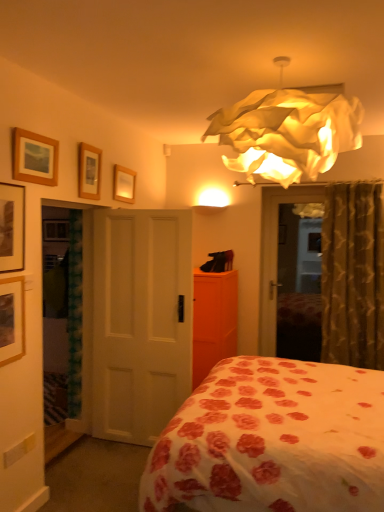
Image resolution: width=384 pixels, height=512 pixels. Describe the element at coordinates (12, 319) in the screenshot. I see `wooden picture frame at left, arranged as the 1th picture frame when viewed from the left` at that location.

Measure the distance between illuminated paper-like lampshade at upper center and camera.

1.90 meters.

At what (x,y) coordinates should I click in order to perform the action: click on wooden picture frame at upper center, which is counted as the first picture frame, starting from the back. Please return your answer as a coordinate pair (x, y). Image resolution: width=384 pixels, height=512 pixels. Looking at the image, I should click on (124, 184).

I want to click on gold textured curtain at right, so click(x=353, y=275).

The height and width of the screenshot is (512, 384). Describe the element at coordinates (135, 321) in the screenshot. I see `white matte door at center` at that location.

Find the location of a particular element. This screenshot has width=384, height=512. orange matte dresser at center is located at coordinates (213, 320).

Is wooden framed picture at upper left, marked as the 3th picture frame in a left-to-right arrangement, oriented away from gold textured curtain at right?

wooden framed picture at upper left, marked as the 3th picture frame in a left-to-right arrangement, does not have its back to gold textured curtain at right.

Looking at the image, does wooden framed picture at upper left, marked as the 3th picture frame in a left-to-right arrangement, seem bigger or smaller compared to gold textured curtain at right?

Considering their sizes, wooden framed picture at upper left, marked as the 3th picture frame in a left-to-right arrangement, takes up less space than gold textured curtain at right.

Is wooden framed picture at upper left, the 3th picture frame viewed from the back, directly adjacent to gold textured curtain at right?

No, wooden framed picture at upper left, the 3th picture frame viewed from the back, is not beside gold textured curtain at right.

From a real-world perspective, does wooden framed picture at upper left, the 3th picture frame viewed from the back, stand above gold textured curtain at right?

Yes, from a real-world perspective, wooden framed picture at upper left, the 3th picture frame viewed from the back, is over gold textured curtain at right

Does point (99, 170) appear closer or farther from the camera than point (10, 325)?

Point (99, 170) is positioned farther from the camera compared to point (10, 325).

Can you tell me how much wooden picture frame at upper center, the 2th picture frame from the right, and wooden picture frame at left, arranged as the 1th picture frame when viewed from the left, differ in facing direction?

The angle between the facing direction of wooden picture frame at upper center, the 2th picture frame from the right, and the facing direction of wooden picture frame at left, arranged as the 1th picture frame when viewed from the left, is 0.456 degrees.

Considering the relative positions of wooden picture frame at upper center, the 4th picture frame from the left, and wooden picture frame at left, placed as the 5th picture frame when sorted from back to front, in the image provided, is wooden picture frame at upper center, the 4th picture frame from the left, to the left or to the right of wooden picture frame at left, placed as the 5th picture frame when sorted from back to front,?

wooden picture frame at upper center, the 4th picture frame from the left, is to the right of wooden picture frame at left, placed as the 5th picture frame when sorted from back to front.

Is wooden picture frame at upper center, the 2th picture frame from the right, facing away from wooden picture frame at left, placed as the 5th picture frame when sorted from back to front?

That's not correct — wooden picture frame at upper center, the 2th picture frame from the right, is not looking away from wooden picture frame at left, placed as the 5th picture frame when sorted from back to front.

Is point (118, 261) positioned after point (197, 320)?

No, it is not.

Is white matte door at center facing towards orange matte dresser at center?

No.

In the image, is white matte door at center positioned in front of or behind orange matte dresser at center?

white matte door at center is positioned closer to the viewer than orange matte dresser at center.

Is white matte door at center wider than gold textured curtain at right?

No, white matte door at center is not wider than gold textured curtain at right.

What's the angular difference between white matte door at center and gold textured curtain at right's facing directions?

The angle between the facing direction of white matte door at center and the facing direction of gold textured curtain at right is 0.2 degrees.

In the scene shown: From a real-world perspective, who is located higher, white matte door at center or gold textured curtain at right?

From a 3D spatial view, gold textured curtain at right is above.

Which is more to the left, white matte door at center or gold textured curtain at right?

Positioned to the left is white matte door at center.

In the scene shown: Are wooden picture frame at left, which ranks as the fifth picture frame in right-to-left order, and wooden picture frame at upper center, the 4th picture frame from the left, beside each other?

No.

Locate an element on the screen. The width and height of the screenshot is (384, 512). the 3rd picture frame counting from the left side of the wooden picture frame at upper center, the 4th picture frame from the left is located at coordinates (12, 319).

Which is in front, wooden picture frame at left, the first picture frame in the front-to-back sequence, or wooden picture frame at upper center, the 2th picture frame from the right?

wooden picture frame at left, the first picture frame in the front-to-back sequence, is closer to the camera.

Are wooden picture frame at left, the first picture frame in the front-to-back sequence, and wooden picture frame at upper center, which is counted as the first picture frame, starting from the back, located far from each other?

Absolutely, wooden picture frame at left, the first picture frame in the front-to-back sequence, is distant from wooden picture frame at upper center, which is counted as the first picture frame, starting from the back.

From a real-world perspective, does wooden picture frame at left, which ranks as the fifth picture frame in right-to-left order, stand above wooden picture frame at upper center, which is counted as the first picture frame, starting from the back?

No, from a real-world perspective, wooden picture frame at left, which ranks as the fifth picture frame in right-to-left order, is not above wooden picture frame at upper center, which is counted as the first picture frame, starting from the back.

From the image's perspective, relative to wooden picture frame at upper center, placed as the fifth picture frame when sorted from front to back, is wooden picture frame at left, which ranks as the fifth picture frame in right-to-left order, above or below?

wooden picture frame at left, which ranks as the fifth picture frame in right-to-left order, is below wooden picture frame at upper center, placed as the fifth picture frame when sorted from front to back.

Is white matte door at center not inside wooden picture frame at upper center, the 4th picture frame from the left?

Absolutely, white matte door at center is external to wooden picture frame at upper center, the 4th picture frame from the left.

Who is smaller, white matte door at center or wooden picture frame at upper center, the 4th picture frame from the left?

With smaller size is wooden picture frame at upper center, the 4th picture frame from the left.

From a real-world perspective, which object stands above the other?

In real-world perspective, wooden picture frame at upper center, the 2th picture frame from the right, is above.

From the image's perspective, is white matte door at center positioned above or below wooden picture frame at upper center, the fourth picture frame from the front?

Based on their image positions, white matte door at center is located beneath wooden picture frame at upper center, the fourth picture frame from the front.

Find the location of a particular element. Image resolution: width=384 pixels, height=512 pixels. picture frame that is the 2nd object located above the gold textured curtain at right (from the image's perspective) is located at coordinates (35, 158).

Where is `the 4th picture frame directly above the wooden picture frame at left, which ranks as the fifth picture frame in right-to-left order (from a real-world perspective)`? the 4th picture frame directly above the wooden picture frame at left, which ranks as the fifth picture frame in right-to-left order (from a real-world perspective) is located at coordinates (89, 170).

In the scene shown: Estimate the real-world distances between objects in this image. Which object is further from matte black picture frame at upper left, positioned as the 4th picture frame in back-to-front order, wooden picture frame at left, arranged as the 1th picture frame when viewed from the left, or orange matte dresser at center?

The object further to matte black picture frame at upper left, positioned as the 4th picture frame in back-to-front order, is orange matte dresser at center.

Looking at this image, based on their spatial positions, is gold textured curtain at right or matte black picture frame at upper left, which ranks as the 2th picture frame in front-to-back order, further from white floral fabric bed at center?

matte black picture frame at upper left, which ranks as the 2th picture frame in front-to-back order, is positioned further to the anchor white floral fabric bed at center.

Estimate the real-world distances between objects in this image. Which object is further from white floral fabric bed at center, wooden picture frame at upper center, the fourth picture frame from the front, or matte black picture frame at upper left, positioned as the 4th picture frame in back-to-front order?

wooden picture frame at upper center, the fourth picture frame from the front, is positioned further to the anchor white floral fabric bed at center.

Estimate the real-world distances between objects in this image. Which object is closer to wooden picture frame at upper center, the 2th picture frame from the right, gold textured curtain at right or matte black picture frame at upper left, positioned as the 4th picture frame in back-to-front order?

matte black picture frame at upper left, positioned as the 4th picture frame in back-to-front order, is positioned closer to the anchor wooden picture frame at upper center, the 2th picture frame from the right.

Based on their spatial positions, is illuminated paper-like lampshade at upper center or orange matte dresser at center closer to wooden picture frame at upper center, the 2th picture frame from the right?

Among the two, orange matte dresser at center is located nearer to wooden picture frame at upper center, the 2th picture frame from the right.

When comparing their distances from gold textured curtain at right, does wooden picture frame at left, placed as the 5th picture frame when sorted from back to front, or matte black picture frame at upper left, which ranks as the 2th picture frame in front-to-back order, seem further?

matte black picture frame at upper left, which ranks as the 2th picture frame in front-to-back order, is further to gold textured curtain at right.

Based on the photo, which object lies further to the anchor point orange matte dresser at center, white matte door at center or wooden picture frame at left, placed as the 5th picture frame when sorted from back to front?

wooden picture frame at left, placed as the 5th picture frame when sorted from back to front.

Looking at the image, which one is located further to white matte door at center, matte black picture frame at upper left, which ranks as the 2th picture frame in front-to-back order, or wooden picture frame at left, the first picture frame in the front-to-back sequence?

The object further to white matte door at center is matte black picture frame at upper left, which ranks as the 2th picture frame in front-to-back order.

Identify the location of door between matte black picture frame at upper left, marked as the fourth picture frame in a right-to-left arrangement, and gold textured curtain at right. This screenshot has height=512, width=384. (135, 321).

Identify the location of door between matte black picture frame at upper left, marked as the fourth picture frame in a right-to-left arrangement, and illuminated paper-like lampshade at upper center. (135, 321).

This screenshot has height=512, width=384. What are the coordinates of `door positioned between matte black picture frame at upper left, which ranks as the 2th picture frame in front-to-back order, and wooden picture frame at upper center, placed as the fifth picture frame when sorted from front to back, from near to far` in the screenshot? It's located at (135, 321).

Locate an element on the screen. This screenshot has height=512, width=384. door between illuminated paper-like lampshade at upper center and orange matte dresser at center along the z-axis is located at coordinates (135, 321).